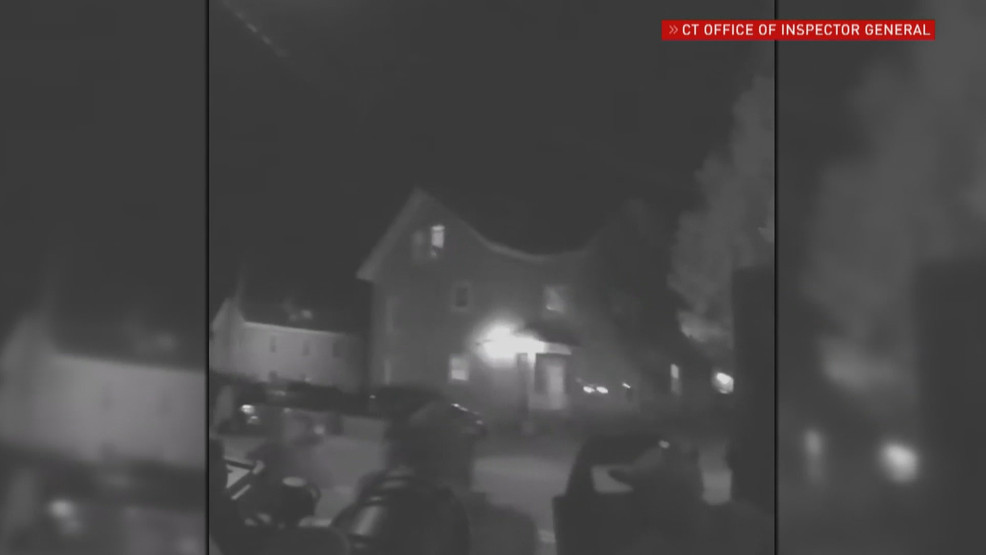
Where is `wall`? wall is located at coordinates (513, 282).